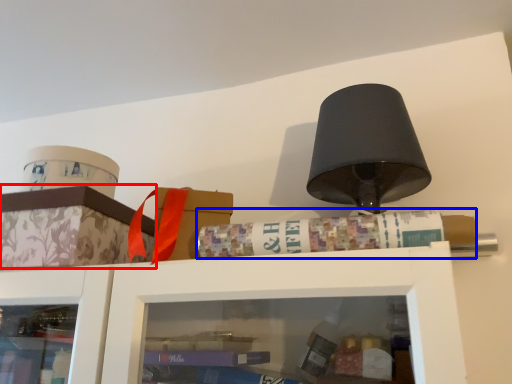
Question: Which point is closer to the camera, cabinetry (highlighted by a red box) or book (highlighted by a blue box)?

Choices:
 (A) cabinetry
 (B) book

Answer: (B)